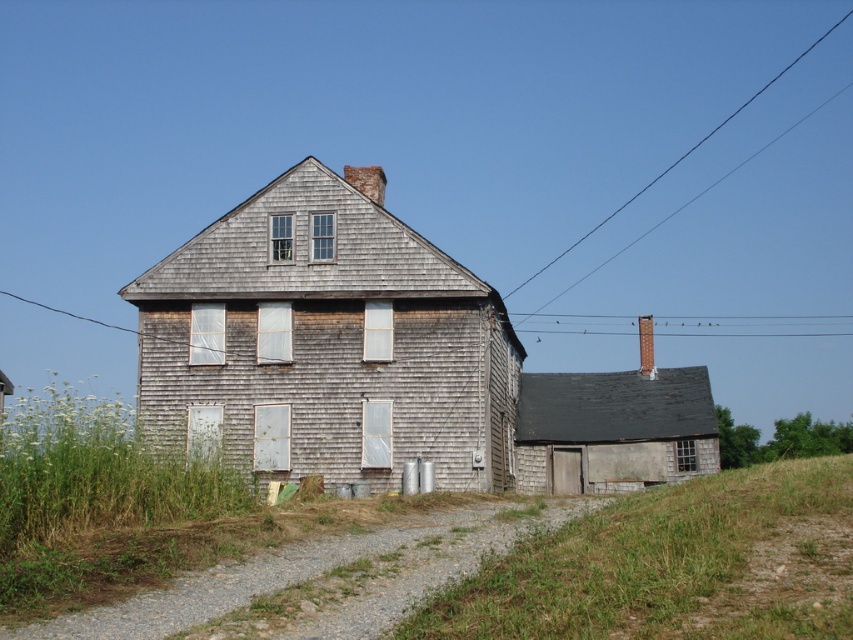
Who is positioned more to the right, green grass at lower right or smooth wire at upper center?

Positioned to the right is smooth wire at upper center.

Who is more forward, (839, 525) or (18, 298)?

Point (839, 525) is in front.

You are a GUI agent. You are given a task and a screenshot of the screen. Output one action in this format:
    pyautogui.click(x=<x>, y=<y>)
    Task: Click on the green grass at lower right
    The width and height of the screenshot is (853, 640).
    Given the screenshot: What is the action you would take?
    pyautogui.click(x=670, y=564)

Is point (523, 552) behind point (584, 237)?

No, (523, 552) is closer to viewer.

Based on the photo, is green grass at lower right behind black wire at upper right?

No, it is in front of black wire at upper right.

Is point (782, 509) positioned behind point (758, 90)?

No, (782, 509) is closer to viewer.

Identify the location of green grass at lower right. The image size is (853, 640). (670, 564).

Can you confirm if black wire at upper right is smaller than smooth wire at upper center?

Yes.

I want to click on black wire at upper right, so click(682, 156).

You are a GUI agent. You are given a task and a screenshot of the screen. Output one action in this format:
    pyautogui.click(x=<x>, y=<y>)
    Task: Click on the black wire at upper right
    The image size is (853, 640).
    Given the screenshot: What is the action you would take?
    pyautogui.click(x=682, y=156)